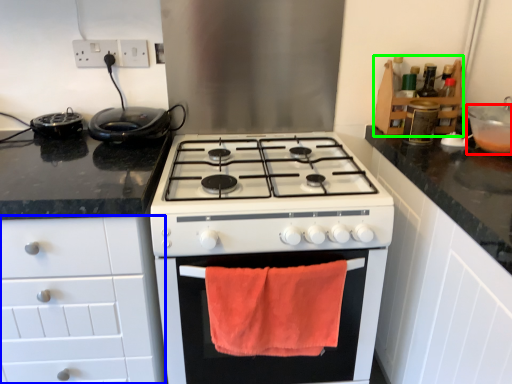
Question: Which object is the closest to the appliance (highlighted by a red box)? Choose among these: cabinetry (highlighted by a blue box) or cabinetry (highlighted by a green box).

Choices:
 (A) cabinetry
 (B) cabinetry

Answer: (B)